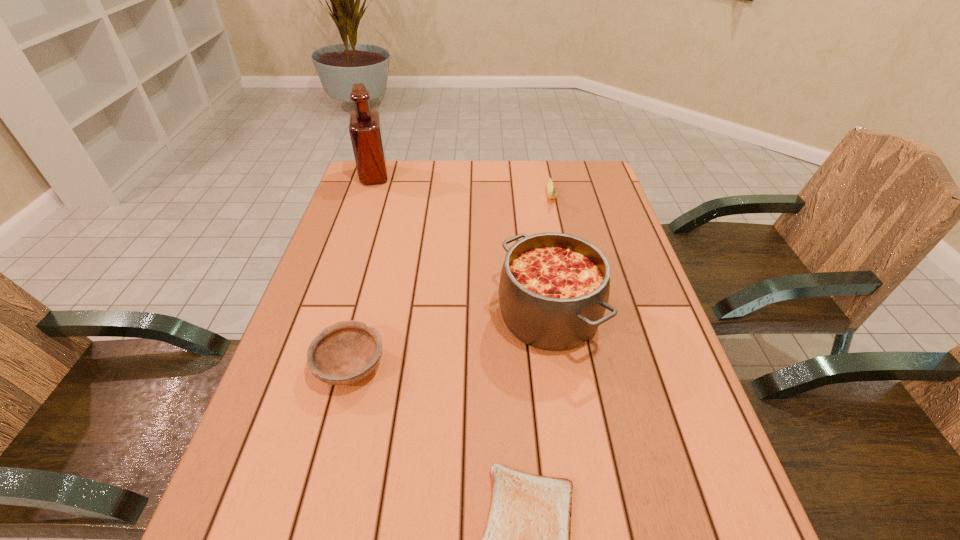
The width and height of the screenshot is (960, 540). What are the coordinates of `the tallest object` in the screenshot? It's located at click(365, 130).

Identify the location of the second tallest object. (554, 288).

The image size is (960, 540). I want to click on banana, so click(551, 191).

The width and height of the screenshot is (960, 540). Find the location of `bowl`. bowl is located at coordinates (346, 352).

This screenshot has width=960, height=540. Identify the location of free space located 0.360m on the front of the liquor. (346, 260).

Where is `free spot located on the left of the casserole`? Image resolution: width=960 pixels, height=540 pixels. free spot located on the left of the casserole is located at coordinates (395, 316).

Where is `vacant space located at the stem of the banana`? This screenshot has height=540, width=960. vacant space located at the stem of the banana is located at coordinates (566, 270).

At what (x,y) coordinates should I click in order to perform the action: click on blank space located on the front of the bowl. Please return your answer as a coordinate pair (x, y). The width and height of the screenshot is (960, 540). Looking at the image, I should click on (310, 523).

In order to click on liquor that is at the far edge in this screenshot , I will do `click(365, 130)`.

At what (x,y) coordinates should I click in order to perform the action: click on banana that is at the far edge. Please return your answer as a coordinate pair (x, y). Looking at the image, I should click on (551, 191).